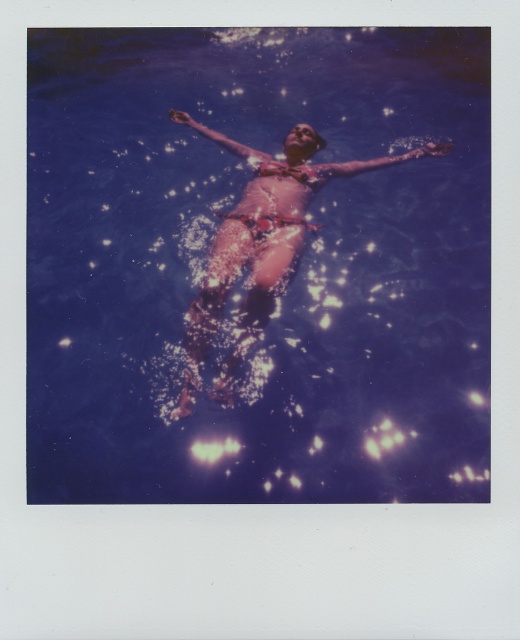
Question: Is transparent blue water at center further to the viewer compared to floral bikini at center?

Choices:
 (A) no
 (B) yes

Answer: (B)

Question: Is transparent blue water at center further to the viewer compared to floral bikini at center?

Choices:
 (A) yes
 (B) no

Answer: (A)

Question: Can you confirm if transparent blue water at center is smaller than floral bikini at center?

Choices:
 (A) no
 (B) yes

Answer: (B)

Question: Which object appears farthest from the camera in this image?

Choices:
 (A) transparent blue water at center
 (B) floral bikini at center

Answer: (A)